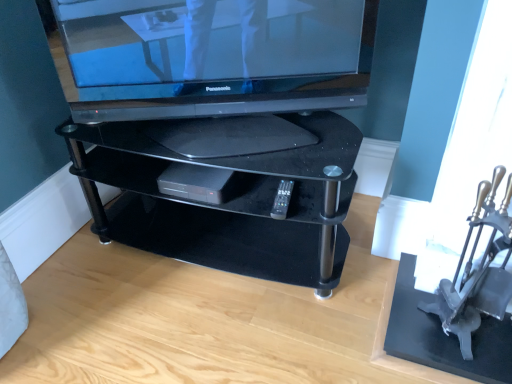
Question: Relative to black plastic dvd player at center, is metallic silver armchair at right in front or behind?

Choices:
 (A) behind
 (B) front

Answer: (B)

Question: Is metallic silver armchair at right inside the boundaries of black plastic dvd player at center, or outside?

Choices:
 (A) inside
 (B) outside

Answer: (B)

Question: Which object is the closest to the black plastic remote at center?

Choices:
 (A) black glass tv stand at center
 (B) black plastic dvd player at center
 (C) satin black television at upper center
 (D) metallic silver armchair at right

Answer: (B)

Question: Which object is the closest to the black plastic dvd player at center?

Choices:
 (A) black plastic remote at center
 (B) black glass tv stand at center
 (C) metallic silver armchair at right
 (D) satin black television at upper center

Answer: (B)